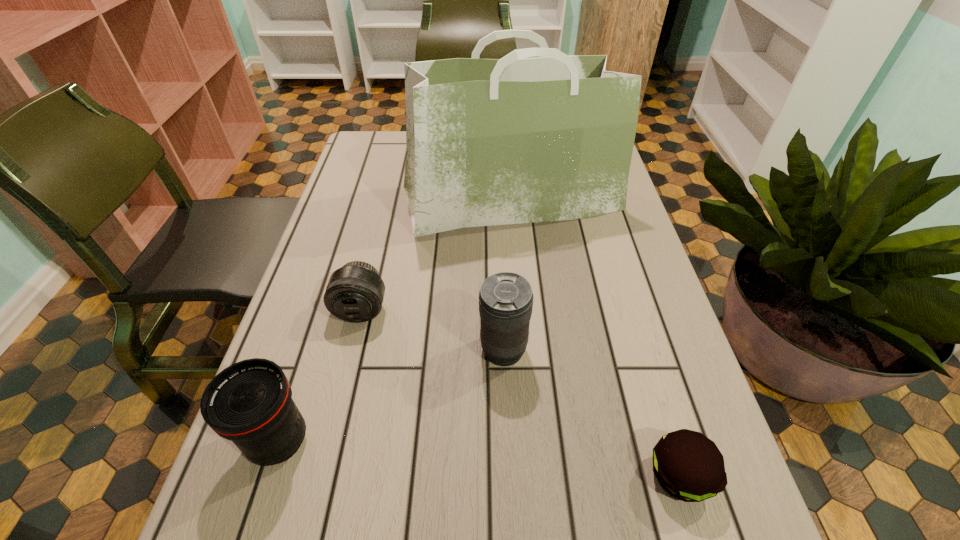
The height and width of the screenshot is (540, 960). Find the location of `telephoto lens that is the closest one to the grocery bag`. telephoto lens that is the closest one to the grocery bag is located at coordinates (355, 292).

Where is `telephoto lens that is the second nearest to the nearest telephoto lens`? The height and width of the screenshot is (540, 960). telephoto lens that is the second nearest to the nearest telephoto lens is located at coordinates (505, 299).

Locate an element on the screen. The image size is (960, 540). vacant space that satisfies the following two spatial constraints: 1. on the front side of the patty; 2. on the right side of the farthest object is located at coordinates (534, 475).